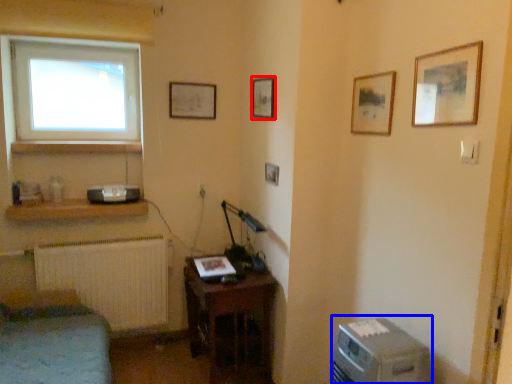
Question: Which object is further to the camera taking this photo, picture frame (highlighted by a red box) or desktop computer (highlighted by a blue box)?

Choices:
 (A) picture frame
 (B) desktop computer

Answer: (A)